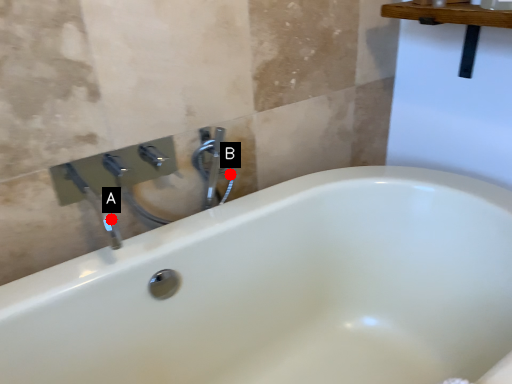
Question: Two points are circled on the image, labeled by A and B beside each circle. Which of the following is the farthest from the observer?

Choices:
 (A) A is further
 (B) B is further

Answer: (B)